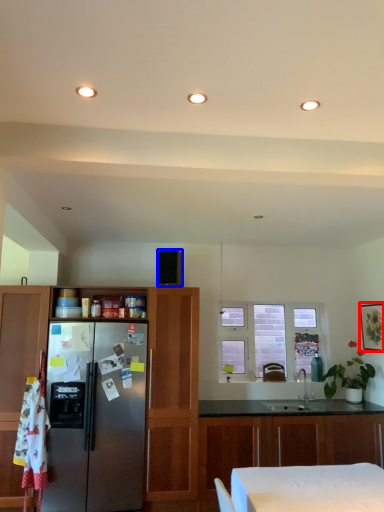
Question: Which object appears closest to the camera in this image, picture frame (highlighted by a red box) or appliance (highlighted by a blue box)?

Choices:
 (A) picture frame
 (B) appliance

Answer: (B)